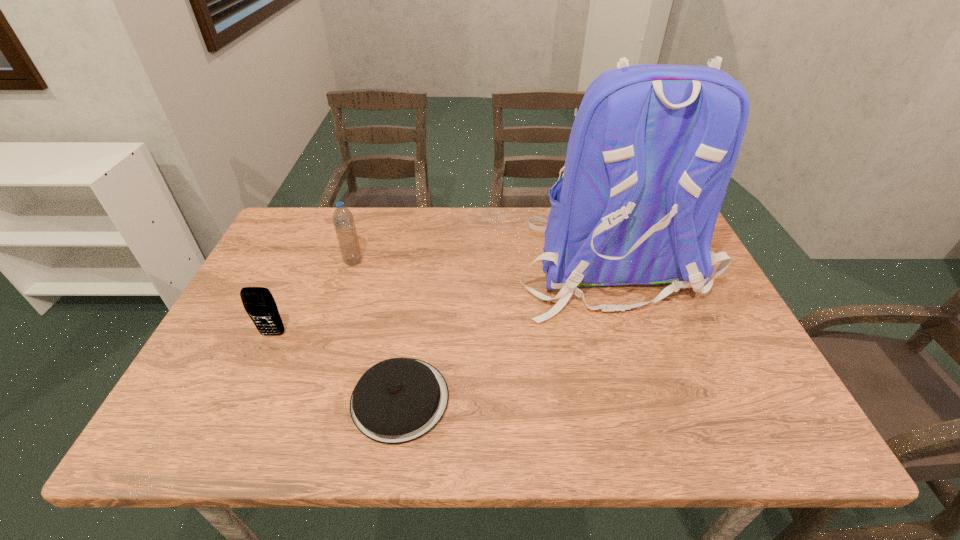
This screenshot has height=540, width=960. In order to click on vacant area between the rightmost object and the shortest object in this screenshot , I will do `click(504, 332)`.

This screenshot has height=540, width=960. What are the coordinates of `object that is the second closest to the leftmost object` in the screenshot? It's located at (343, 220).

In order to click on object that is the closest one to the rightmost object in this screenshot , I will do `click(398, 400)`.

Image resolution: width=960 pixels, height=540 pixels. I want to click on free space that satisfies the following two spatial constraints: 1. on the front side of the second object from right to left; 2. on the right side of the water bottle, so click(x=308, y=400).

Where is `vacant area that satisfies the following two spatial constraints: 1. on the screen of the third object from left to right; 2. on the right side of the second shortest object`? The height and width of the screenshot is (540, 960). vacant area that satisfies the following two spatial constraints: 1. on the screen of the third object from left to right; 2. on the right side of the second shortest object is located at coordinates (243, 400).